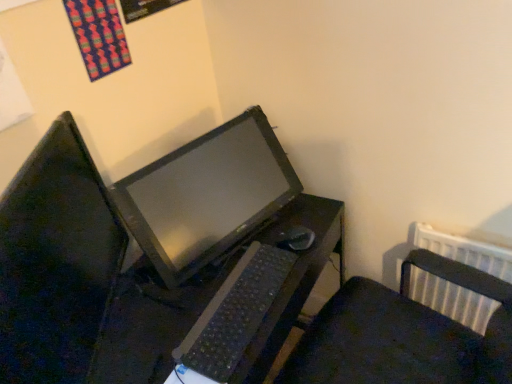
The width and height of the screenshot is (512, 384). What are the coordinates of `black plastic keyboard at center` in the screenshot? It's located at (232, 316).

Locate an element on the screen. Image resolution: width=512 pixels, height=384 pixels. matte black monitor at center is located at coordinates click(x=56, y=261).

Find the location of `black plastic table at center`. black plastic table at center is located at coordinates (207, 195).

What are the coordinates of `black plastic desk at center` in the screenshot? It's located at (152, 322).

Where is `black plastic mouse at center`? Image resolution: width=512 pixels, height=384 pixels. black plastic mouse at center is located at coordinates (296, 239).

Could black plastic desk at center be considered to be inside black plastic table at center?

No, black plastic desk at center is not a part of black plastic table at center.

In the image, is black plastic table at center positioned in front of or behind black plastic desk at center?

Visually, black plastic table at center is located behind black plastic desk at center.

From the image's perspective, relative to black plastic desk at center, is black plastic table at center above or below?

black plastic table at center is above black plastic desk at center.

Can you confirm if black plastic table at center is positioned to the right of black plastic desk at center?

Incorrect, black plastic table at center is not on the right side of black plastic desk at center.

Consider the image. Is black plastic keyboard at center bigger or smaller than black plastic desk at center?

Clearly, black plastic keyboard at center is smaller in size than black plastic desk at center.

In the scene shown: Is black plastic keyboard at center looking in the opposite direction of black plastic desk at center?

That's not correct — black plastic keyboard at center is not looking away from black plastic desk at center.

Is point (279, 256) positioned before point (162, 309)?

No, it is behind (162, 309).

Is black plastic keyboard at center taller or shorter than black plastic desk at center?

Clearly, black plastic keyboard at center is shorter compared to black plastic desk at center.

Identify the location of computer monitor located on the left of black plastic desk at center. (56, 261).

Does black plastic desk at center have a lesser height compared to matte black monitor at center?

Answer: No.

Based on the photo, how far apart are matte black monitor at center and black plastic table at center?

The distance of matte black monitor at center from black plastic table at center is 11.81 inches.

Is matte black monitor at center bigger than black plastic table at center?

Actually, matte black monitor at center might be smaller than black plastic table at center.

At what (x,y) coordinates should I click in order to perform the action: click on computer monitor on the left of black plastic table at center. Please return your answer as a coordinate pair (x, y). This screenshot has width=512, height=384. Looking at the image, I should click on click(56, 261).

Based on the photo, relative to black plastic table at center, is matte black monitor at center in front or behind?

Visually, matte black monitor at center is located in front of black plastic table at center.

Can you confirm if black plastic table at center is positioned to the right of black plastic mouse at center?

Incorrect, black plastic table at center is not on the right side of black plastic mouse at center.

From the image's perspective, which object appears higher, black plastic table at center or black plastic mouse at center?

black plastic table at center appears higher in the image.

Is black plastic table at center oriented away from black plastic mouse at center?

That's right, black plastic table at center is facing away from black plastic mouse at center.

From the image's perspective, relative to black plastic desk at center, is black plastic mouse at center above or below?

black plastic mouse at center is above black plastic desk at center.

Is black plastic mouse at center completely or partially outside of black plastic desk at center?

Yes, black plastic mouse at center is outside of black plastic desk at center.

Can you tell me how much black plastic mouse at center and black plastic desk at center differ in facing direction?

2.77 degrees separate the facing orientations of black plastic mouse at center and black plastic desk at center.

Would you consider black plastic keyboard at center to be distant from black plastic table at center?

No.

This screenshot has height=384, width=512. I want to click on computer keyboard located on the right of black plastic table at center, so click(232, 316).

Who is shorter, black plastic keyboard at center or black plastic table at center?

black plastic keyboard at center is shorter.

This screenshot has width=512, height=384. Find the location of `desk located underneath the black plastic table at center (from a real-world perspective)`. desk located underneath the black plastic table at center (from a real-world perspective) is located at coordinates (152, 322).

Image resolution: width=512 pixels, height=384 pixels. In order to click on desk in front of the black plastic keyboard at center in this screenshot , I will do `click(152, 322)`.

Based on their spatial positions, is black plastic mouse at center or black plastic table at center closer to black plastic desk at center?

black plastic table at center.

Based on the photo, from the image, which object appears to be nearer to black plastic mouse at center, black plastic desk at center or black plastic keyboard at center?

Based on the image, black plastic keyboard at center appears to be nearer to black plastic mouse at center.

Based on their spatial positions, is black plastic desk at center or black plastic keyboard at center closer to black plastic table at center?

Based on the image, black plastic desk at center appears to be nearer to black plastic table at center.

Looking at the image, which one is located closer to black plastic table at center, black plastic mouse at center or black plastic keyboard at center?

The object closer to black plastic table at center is black plastic keyboard at center.

Considering their positions, is black plastic table at center positioned closer to black plastic keyboard at center than black plastic mouse at center?

black plastic mouse at center is positioned closer to the anchor black plastic keyboard at center.

Consider the image. From the image, which object appears to be nearer to black plastic keyboard at center, black plastic table at center or matte black monitor at center?

black plastic table at center is positioned closer to the anchor black plastic keyboard at center.

Looking at the image, which one is located closer to matte black monitor at center, black plastic table at center or black plastic mouse at center?

black plastic table at center is closer to matte black monitor at center.

From the image, which object appears to be nearer to black plastic desk at center, black plastic keyboard at center or black plastic table at center?

black plastic keyboard at center lies closer to black plastic desk at center than the other object.

The width and height of the screenshot is (512, 384). In order to click on desk between matte black monitor at center and black plastic keyboard at center along the z-axis in this screenshot , I will do `click(152, 322)`.

You are a GUI agent. You are given a task and a screenshot of the screen. Output one action in this format:
    pyautogui.click(x=<x>, y=<y>)
    Task: Click on the mouse between black plastic table at center and black plastic desk at center vertically
    This screenshot has width=512, height=384.
    Given the screenshot: What is the action you would take?
    pyautogui.click(x=296, y=239)

Identify the location of computer keyboard located between black plastic desk at center and black plastic mouse at center in the depth direction. (232, 316).

Locate an element on the screen. This screenshot has width=512, height=384. desk between matte black monitor at center and black plastic mouse at center from front to back is located at coordinates (x=152, y=322).